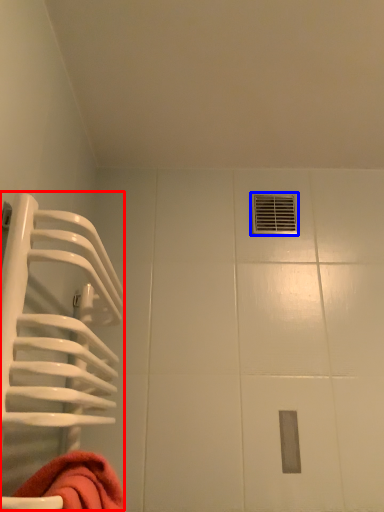
Question: Which of the following is the closest to the observer, cage (highlighted by a red box) or hole (highlighted by a blue box)?

Choices:
 (A) cage
 (B) hole

Answer: (A)